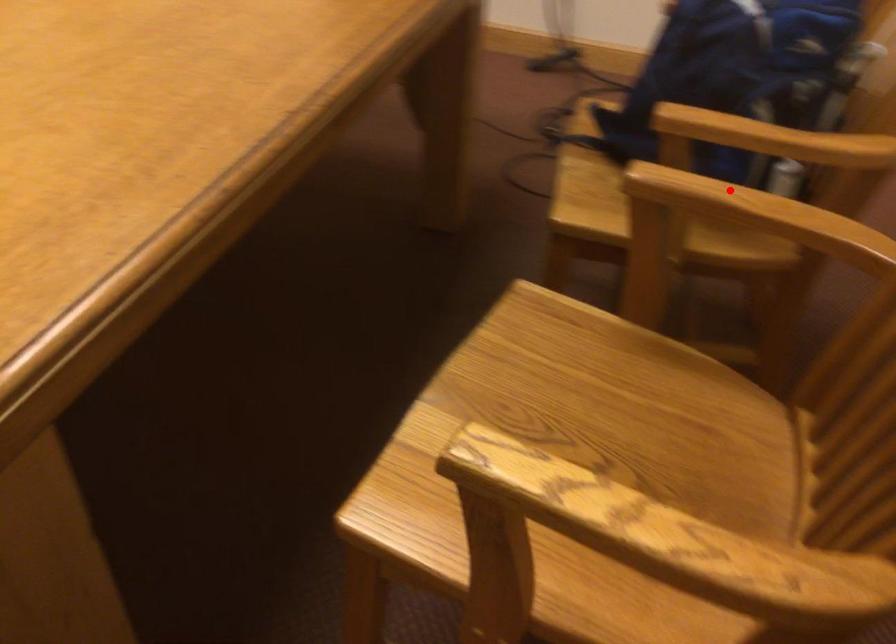
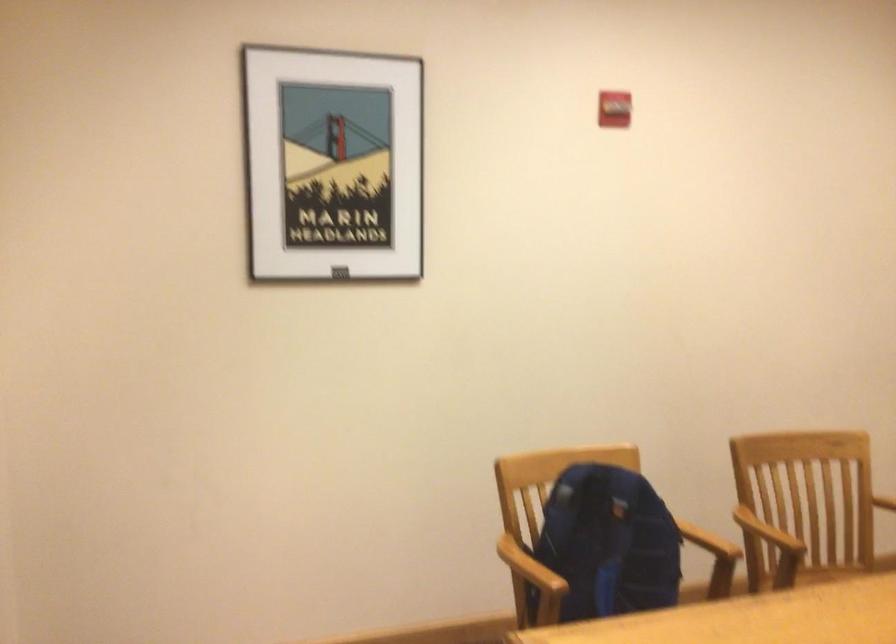
Locate, in the second image, the point that corresponds to the highlighted location in the first image.

(767, 532)